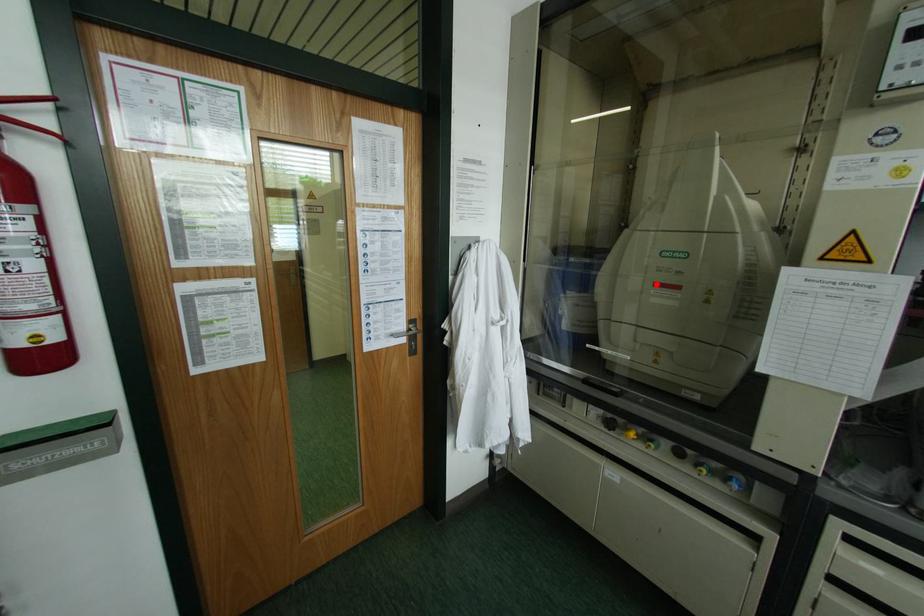
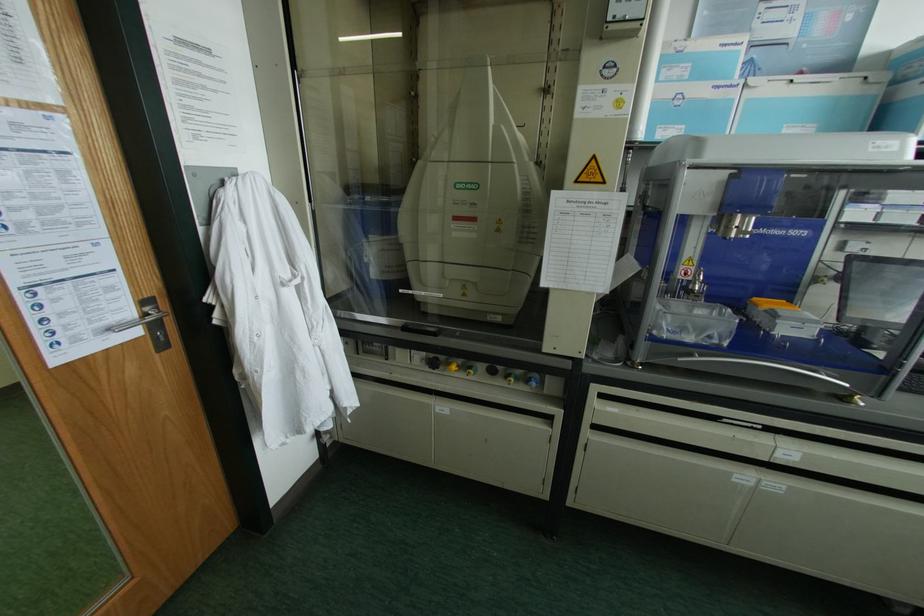
Question: I am providing you with two images of the same scene from different viewpoints. A red point is shown in image1. For the corresponding object point in image2, is it positioned nearer or farther from the camera?

Choices:
 (A) Nearer
 (B) Farther

Answer: (B)